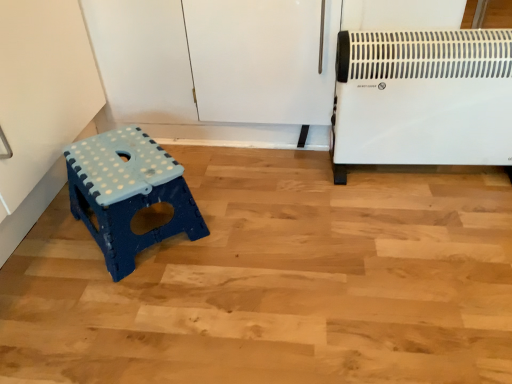
The image size is (512, 384). I want to click on free region on the left part of white plastic heater at right, so click(x=309, y=198).